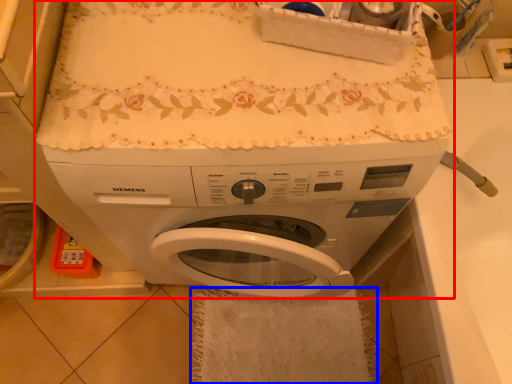
Question: Which point is closer to the camera, washing machine (highlighted by a red box) or bath towel (highlighted by a blue box)?

Choices:
 (A) washing machine
 (B) bath towel

Answer: (A)